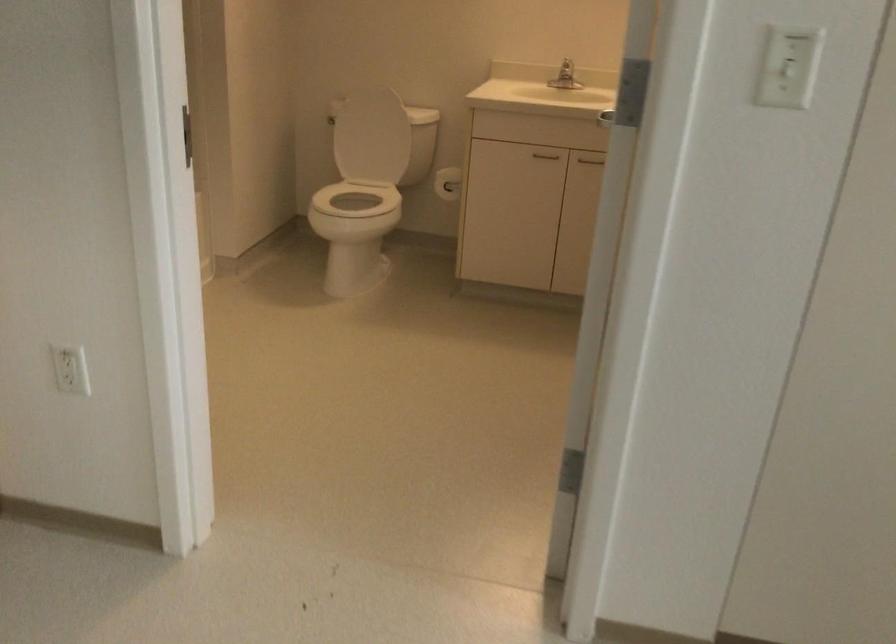
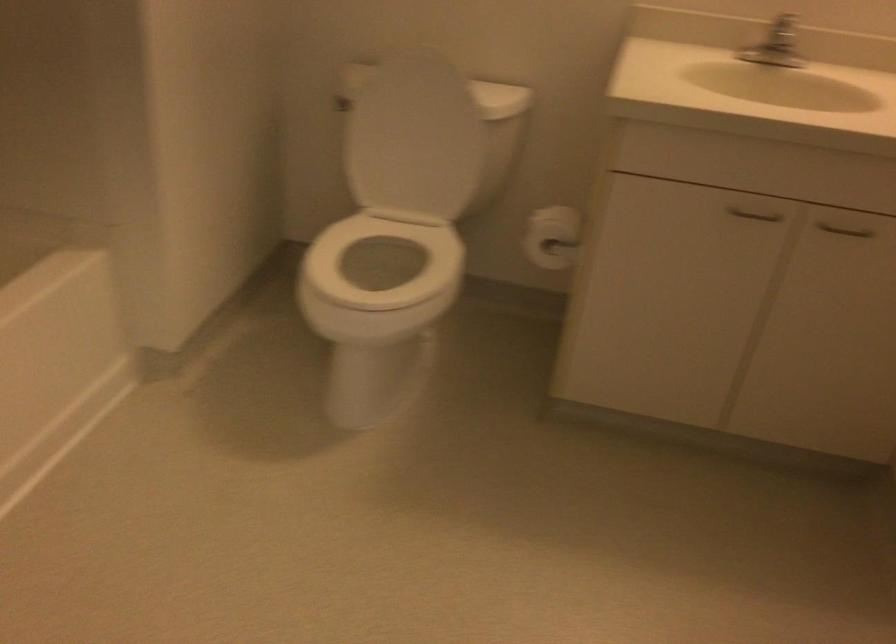
The point at (384, 90) is marked in the first image. Where is the corresponding point in the second image?

(440, 61)